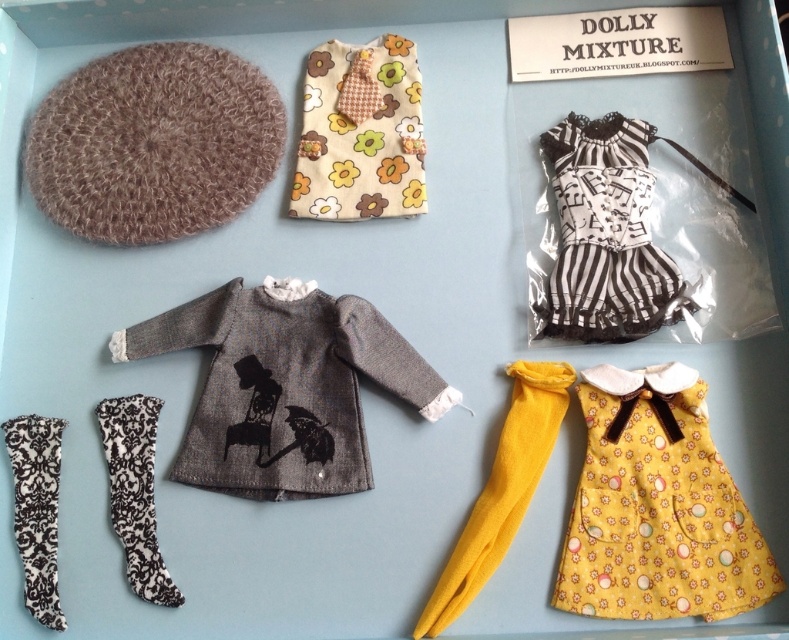
Which of these two, black damask socks at lower left or black damask sock at lower left, stands shorter?

With less height is black damask sock at lower left.

You are a GUI agent. You are given a task and a screenshot of the screen. Output one action in this format:
    pyautogui.click(x=<x>, y=<y>)
    Task: Click on the black damask socks at lower left
    The image size is (789, 640).
    Given the screenshot: What is the action you would take?
    (135, 492)

Locate an element on the screen. The image size is (789, 640). yellow fabric dress at lower right is located at coordinates (657, 508).

This screenshot has width=789, height=640. Describe the element at coordinates (657, 508) in the screenshot. I see `yellow fabric dress at lower right` at that location.

Does point (597, 538) lie behind point (148, 522)?

No.

Find the location of `yellow fabric dress at lower right`. yellow fabric dress at lower right is located at coordinates click(657, 508).

Is yellow fabric dress at lower right bigger than black damask sock at lower left?

Yes.

What do you see at coordinates (657, 508) in the screenshot?
I see `yellow fabric dress at lower right` at bounding box center [657, 508].

The height and width of the screenshot is (640, 789). I want to click on yellow fabric dress at lower right, so click(x=657, y=508).